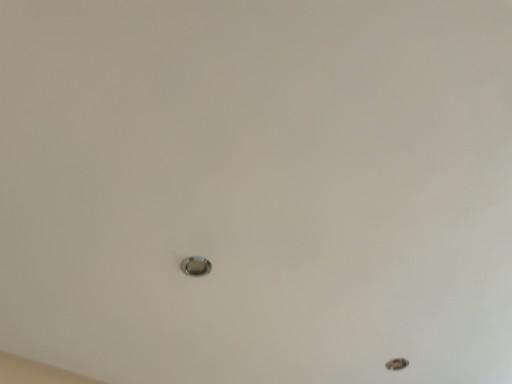
In order to face metallic circular hole at lower right, should I rotate leftwards or rightwards?

It's best to rotate right around 18.448 degrees.

Describe the element at coordinates (397, 364) in the screenshot. This screenshot has height=384, width=512. I see `metallic circular hole at lower right` at that location.

This screenshot has width=512, height=384. In order to click on metallic circular hole at lower right in this screenshot , I will do `click(397, 364)`.

Measure the distance between metallic circular hole at lower right and camera.

4.88 feet.

Measure the distance between point [401,366] and camera.

Point [401,366] and camera are 1.53 meters apart from each other.

Describe the element at coordinates (196, 266) in the screenshot. The height and width of the screenshot is (384, 512). I see `satin silver knob at center` at that location.

Locate an element on the screen. This screenshot has height=384, width=512. satin silver knob at center is located at coordinates (196, 266).

Identify the location of metallic circular hole at lower right. This screenshot has width=512, height=384. (397, 364).

Which object is positioned more to the right, metallic circular hole at lower right or satin silver knob at center?

Positioned to the right is metallic circular hole at lower right.

Is metallic circular hole at lower right positioned in front of satin silver knob at center?

No, it is behind satin silver knob at center.

Which point is more forward, (x=396, y=363) or (x=207, y=264)?

The point (x=207, y=264) is closer to the camera.

From the image's perspective, is metallic circular hole at lower right located above or below satin silver knob at center?

metallic circular hole at lower right is situated lower than satin silver knob at center in the image.

From a real-world perspective, which object stands above the other?

metallic circular hole at lower right.

Is metallic circular hole at lower right wider or thinner than satin silver knob at center?

Considering their sizes, metallic circular hole at lower right looks broader than satin silver knob at center.

Does metallic circular hole at lower right have a lesser height compared to satin silver knob at center?

No.

Between metallic circular hole at lower right and satin silver knob at center, which one has larger size?

With larger size is metallic circular hole at lower right.

Would you say metallic circular hole at lower right contains satin silver knob at center?

No, satin silver knob at center is not inside metallic circular hole at lower right.

Is metallic circular hole at lower right next to satin silver knob at center?

No, metallic circular hole at lower right is not touching satin silver knob at center.

Is satin silver knob at center at the back of metallic circular hole at lower right?

No.

Measure the distance between metallic circular hole at lower right and satin silver knob at center.

metallic circular hole at lower right is 33.06 inches away from satin silver knob at center.

At what (x,y) coordinates should I click in order to perform the action: click on knob located underneath the metallic circular hole at lower right (from a real-world perspective). Please return your answer as a coordinate pair (x, y). The width and height of the screenshot is (512, 384). Looking at the image, I should click on (196, 266).

Can you confirm if satin silver knob at center is positioned to the left of metallic circular hole at lower right?

Correct, you'll find satin silver knob at center to the left of metallic circular hole at lower right.

Is the depth of satin silver knob at center greater than that of metallic circular hole at lower right?

No, satin silver knob at center is closer to the camera.

Which is farther, (197, 264) or (392, 366)?

The point (392, 366) is more distant.

From the picture: From the image's perspective, which is below, satin silver knob at center or metallic circular hole at lower right?

metallic circular hole at lower right appears lower in the image.

From a real-world perspective, which object stands above the other?

From a 3D spatial view, metallic circular hole at lower right is above.

In terms of width, does satin silver knob at center look wider or thinner when compared to metallic circular hole at lower right?

satin silver knob at center is thinner than metallic circular hole at lower right.

Looking at this image, considering the sizes of objects satin silver knob at center and metallic circular hole at lower right in the image provided, who is shorter, satin silver knob at center or metallic circular hole at lower right?

With less height is satin silver knob at center.

Considering the sizes of satin silver knob at center and metallic circular hole at lower right in the image, is satin silver knob at center bigger or smaller than metallic circular hole at lower right?

satin silver knob at center is smaller than metallic circular hole at lower right.

Is satin silver knob at center not within metallic circular hole at lower right?

Yes, satin silver knob at center is located beyond the bounds of metallic circular hole at lower right.

Is satin silver knob at center directly adjacent to metallic circular hole at lower right?

No, satin silver knob at center is not in contact with metallic circular hole at lower right.

Does satin silver knob at center turn towards metallic circular hole at lower right?

Yes, satin silver knob at center is aimed at metallic circular hole at lower right.

How different are the orientations of satin silver knob at center and metallic circular hole at lower right in degrees?

179 degrees separate the facing orientations of satin silver knob at center and metallic circular hole at lower right.

Measure the distance from satin silver knob at center to metallic circular hole at lower right.

33.06 inches.

Locate an element on the screen. knob below the metallic circular hole at lower right (from a real-world perspective) is located at coordinates (196, 266).

Find the location of a particular element. The height and width of the screenshot is (384, 512). hole behind the satin silver knob at center is located at coordinates (397, 364).

The image size is (512, 384). I want to click on hole that is below the satin silver knob at center (from the image's perspective), so click(397, 364).